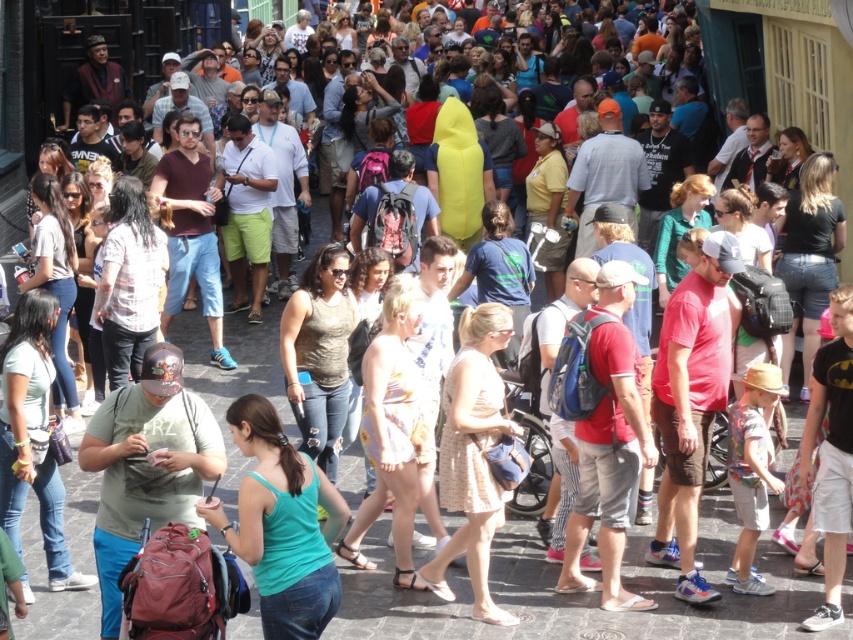
Question: Which object is the farthest from the ripped denim jeans at center?

Choices:
 (A) light blue denim jeans at lower left
 (B) teal fabric tank top at center

Answer: (B)

Question: Can you confirm if plaid shirt at center is bigger than denim jeans at left?

Choices:
 (A) yes
 (B) no

Answer: (B)

Question: Does teal fabric tank top at center come behind light blue denim jeans at lower left?

Choices:
 (A) yes
 (B) no

Answer: (B)

Question: Considering the real-world distances, which object is closest to the black denim shorts at right?

Choices:
 (A) floral print dress at center
 (B) printed cotton dress at center

Answer: (B)

Question: Is teal fabric tank top at center below light blue denim jeans at lower left?

Choices:
 (A) yes
 (B) no

Answer: (A)

Question: Among these objects, which one is farthest from the camera?

Choices:
 (A) plaid shirt at center
 (B) floral print dress at center
 (C) black denim shorts at right
 (D) denim jeans at left

Answer: (C)